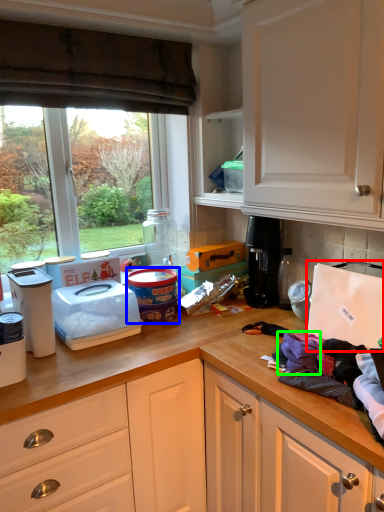
Question: Which is farther away from appliance (highlighted by a red box)? appliance (highlighted by a blue box) or clothing (highlighted by a green box)?

Choices:
 (A) appliance
 (B) clothing

Answer: (A)